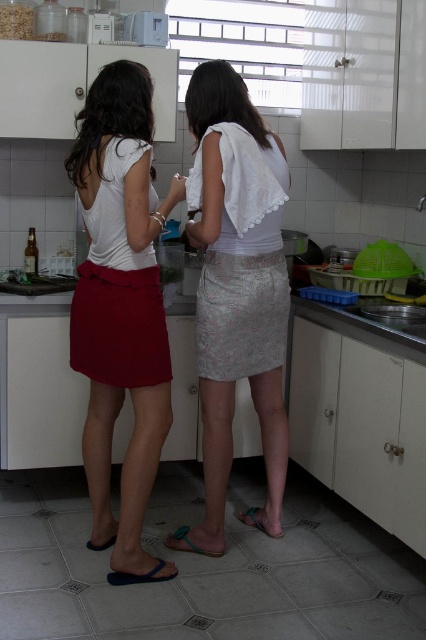
Between point (100, 372) and point (230, 116), which one is positioned behind?

The point (100, 372) is more distant.

Image resolution: width=426 pixels, height=640 pixels. Identify the location of matte red skirt at left. (120, 308).